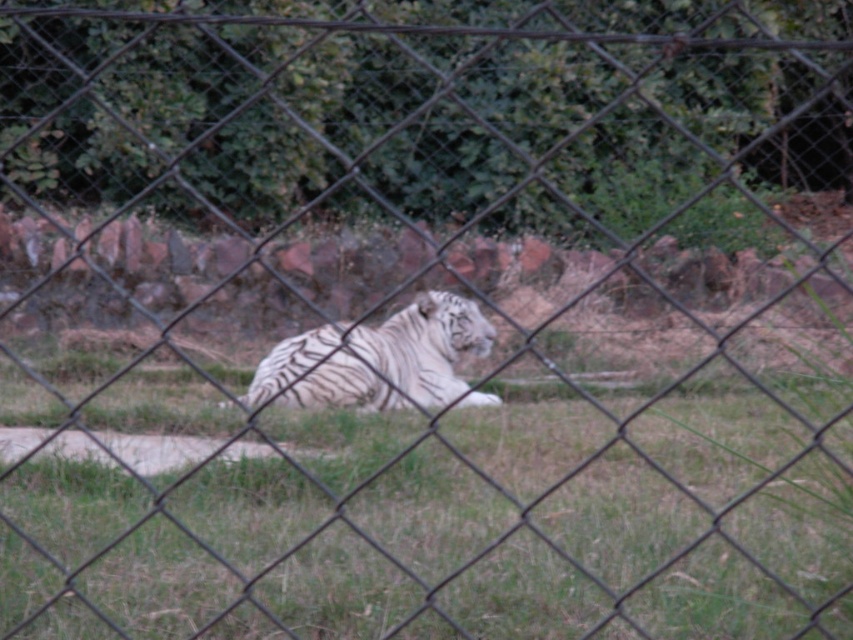
Is green grass at center thinner than white striped tiger at center?

No, green grass at center is not thinner than white striped tiger at center.

Which is behind, point (338, 419) or point (442, 310)?

Positioned behind is point (442, 310).

Is point (650, 584) less distant than point (434, 358)?

That is True.

Find the location of a particular element. green grass at center is located at coordinates (421, 515).